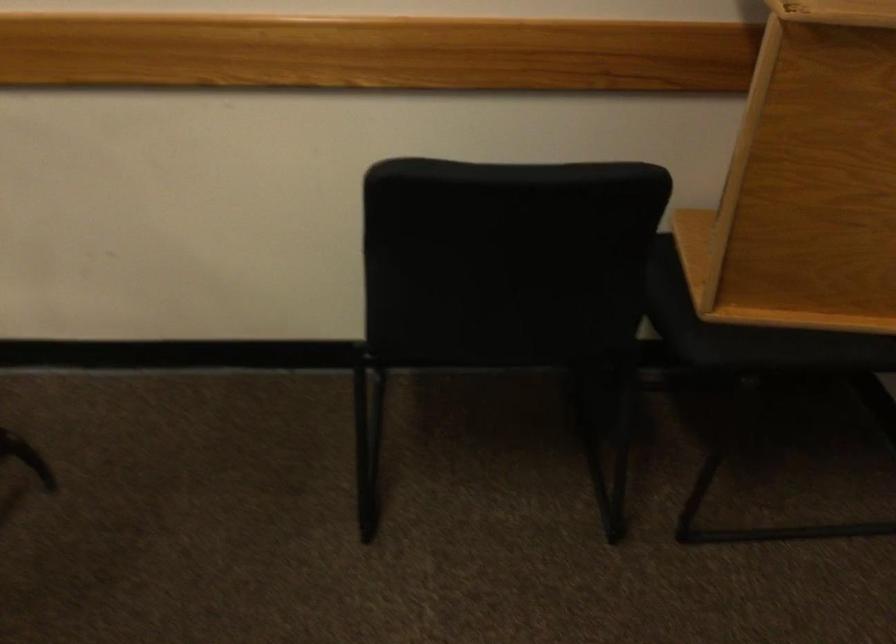
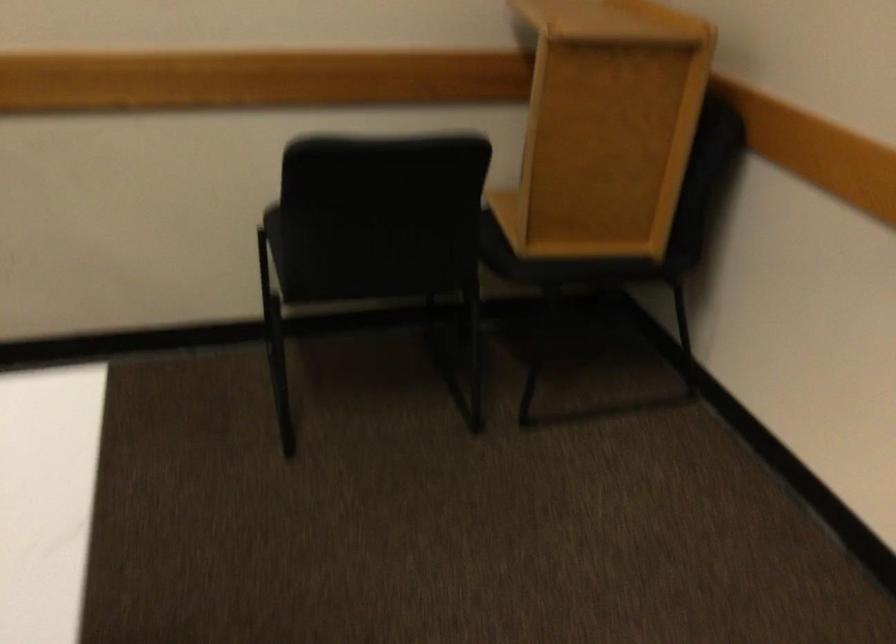
Find the pixel in the second image that matches the point at 800,345 in the first image.

(586, 263)